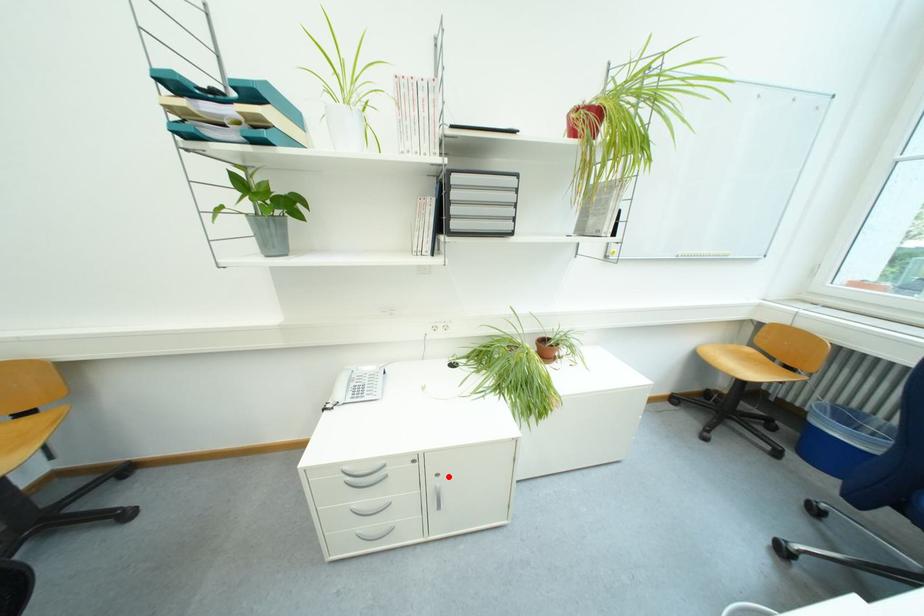
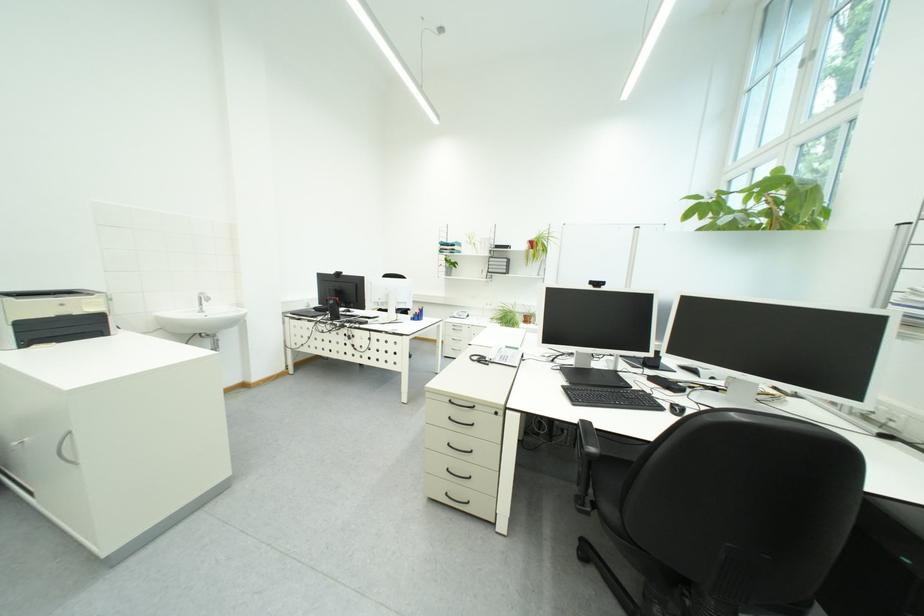
Question: I am providing you with two images of the same scene from different viewpoints. A red point is marked on the first image. Is the red point's position out of view in image 2?

Choices:
 (A) Yes
 (B) No

Answer: (A)